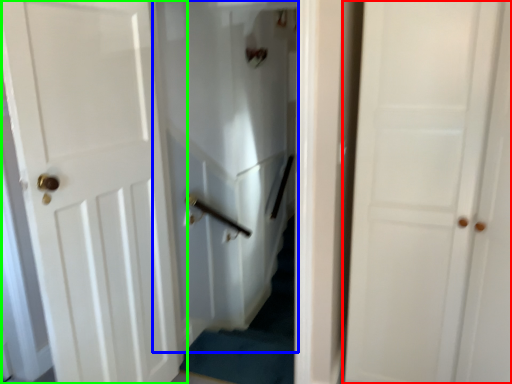
Question: Which is nearer to the door (highlighted by a red box)? elevator (highlighted by a blue box) or door (highlighted by a green box).

Choices:
 (A) elevator
 (B) door

Answer: (B)